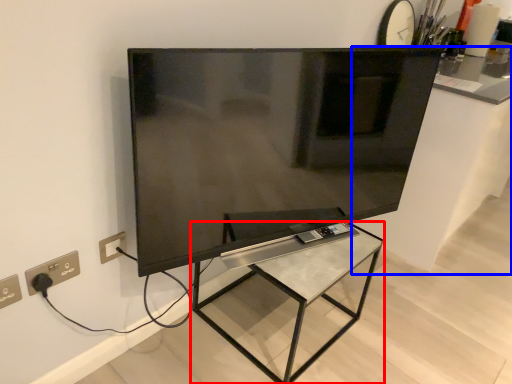
Question: Which object appears farthest to the camera in this image, furniture (highlighted by a red box) or counter top (highlighted by a blue box)?

Choices:
 (A) furniture
 (B) counter top

Answer: (B)